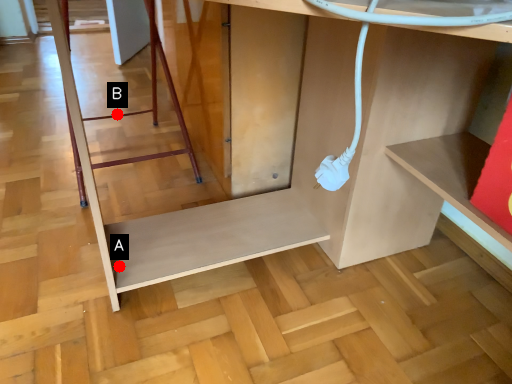
Question: Two points are circled on the image, labeled by A and B beside each circle. Which point is closer to the camera?

Choices:
 (A) A is closer
 (B) B is closer

Answer: (A)